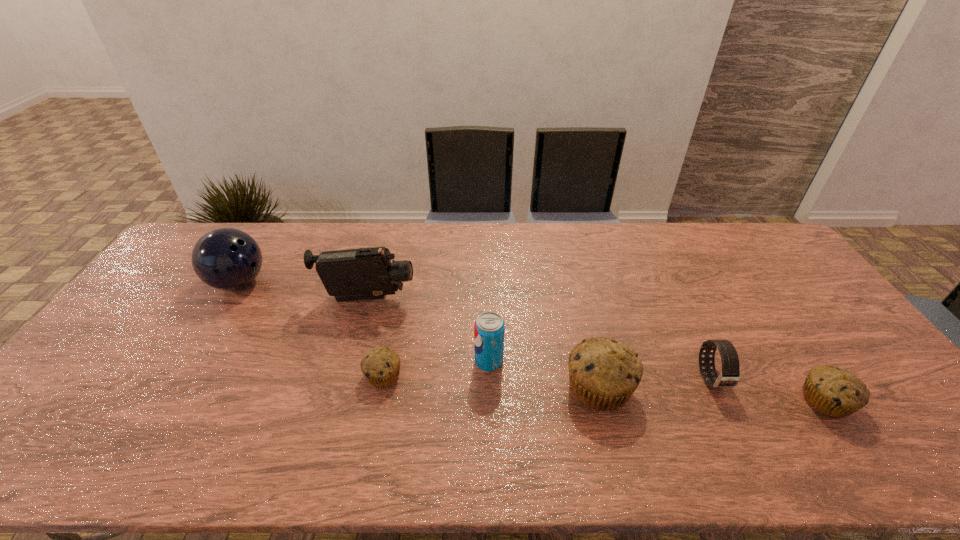
Where is `free location that satisfies the following two spatial constraints: 1. on the surface of the leftmost object near the finger holes; 2. on the left side of the shortest muffin`? free location that satisfies the following two spatial constraints: 1. on the surface of the leftmost object near the finger holes; 2. on the left side of the shortest muffin is located at coordinates (181, 375).

The image size is (960, 540). I want to click on vacant point that satisfies the following two spatial constraints: 1. on the front side of the rightmost object; 2. on the left side of the fourth object from left to right, so click(490, 401).

The height and width of the screenshot is (540, 960). Find the location of `free point that satisfies the following two spatial constraints: 1. on the back side of the shortest muffin; 2. on the left side of the fourth object from left to right`. free point that satisfies the following two spatial constraints: 1. on the back side of the shortest muffin; 2. on the left side of the fourth object from left to right is located at coordinates (386, 362).